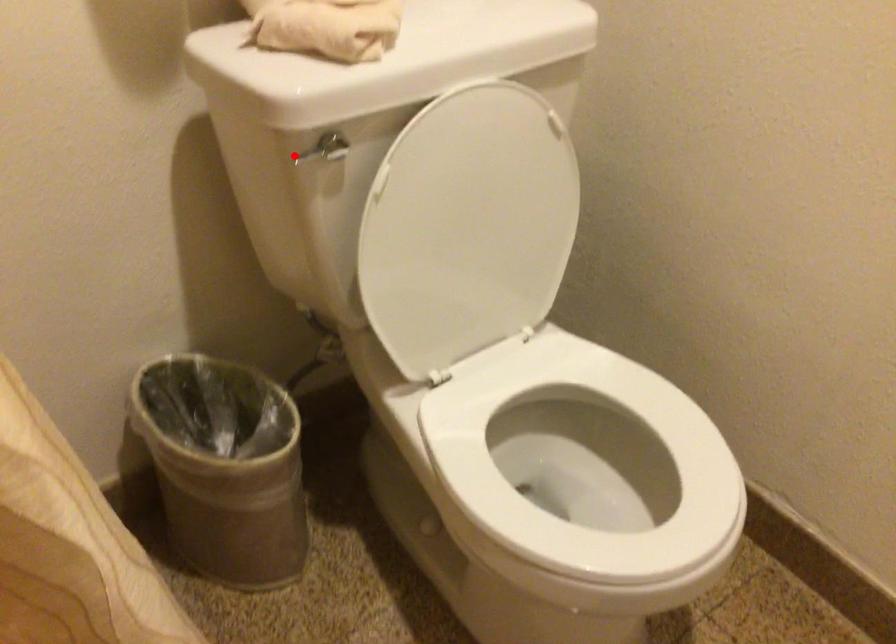
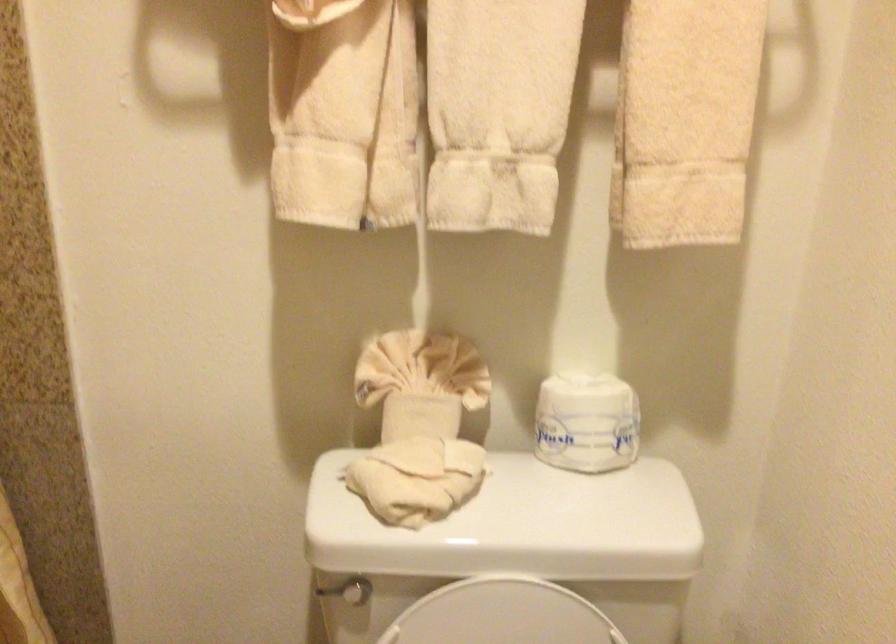
Question: I am providing you with two images of the same scene from different viewpoints. Image1 has a red point marked. In image2, the corresponding 3D location appears at what relative position? Reply with the corresponding letter.

Choices:
 (A) Closer
 (B) Farther

Answer: (B)